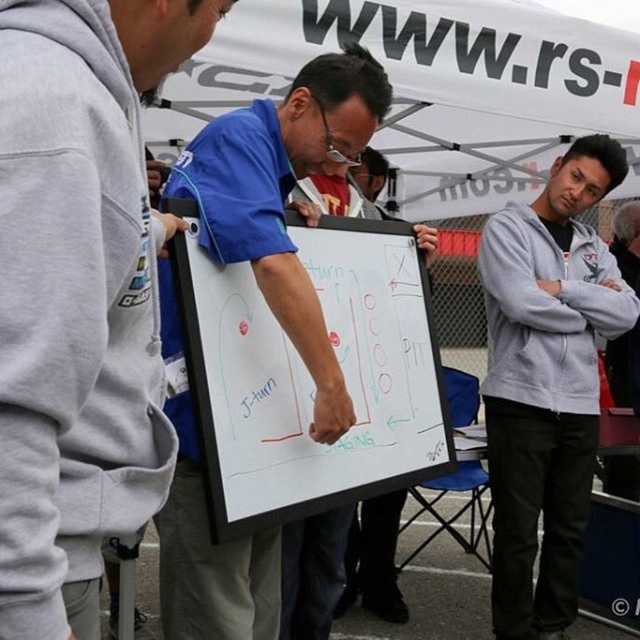
Question: Can you confirm if gray fleece jacket at right is positioned below whiteboard at center?

Choices:
 (A) no
 (B) yes

Answer: (A)

Question: Which point is closer to the camera?

Choices:
 (A) gray fleece jacket at right
 (B) gray fleece hoodie at left

Answer: (B)

Question: Is gray fleece hoodie at left thinner than whiteboard at center?

Choices:
 (A) yes
 (B) no

Answer: (A)

Question: Considering the relative positions of white matte clipboard at center and whiteboard at center in the image provided, where is white matte clipboard at center located with respect to whiteboard at center?

Choices:
 (A) left
 (B) right

Answer: (A)

Question: Which of the following is the farthest from the observer?

Choices:
 (A) pyautogui.click(x=573, y=572)
 (B) pyautogui.click(x=385, y=602)
 (C) pyautogui.click(x=230, y=493)
 (D) pyautogui.click(x=51, y=520)

Answer: (B)

Question: Estimate the real-world distances between objects in this image. Which object is farther from the white matte clipboard at center?

Choices:
 (A) gray fleece hoodie at left
 (B) whiteboard at center
 (C) gray fleece jacket at right

Answer: (B)